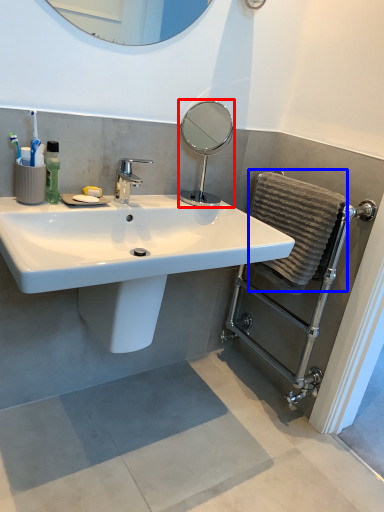
Question: Which object is further to the camera taking this photo, mirror (highlighted by a red box) or bath towel (highlighted by a blue box)?

Choices:
 (A) mirror
 (B) bath towel

Answer: (A)